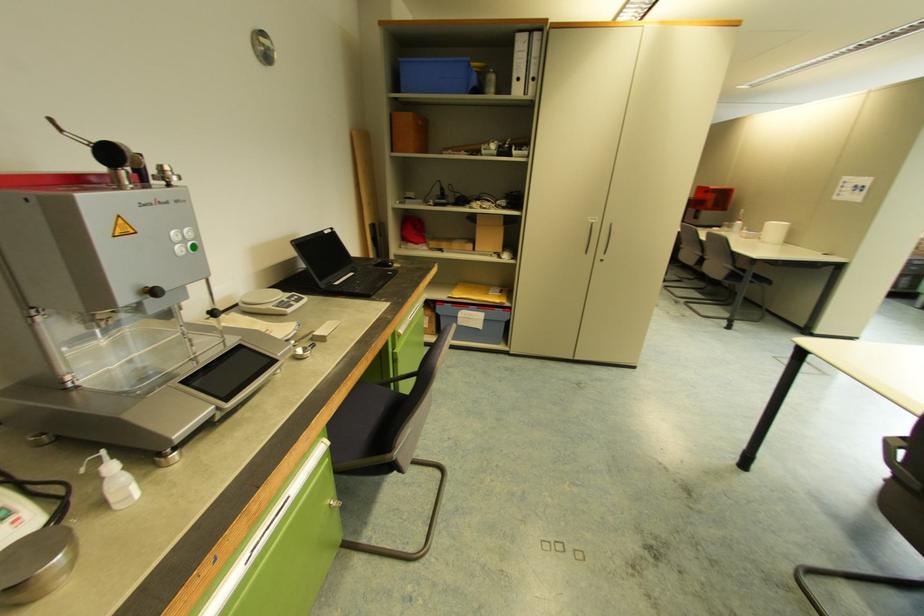
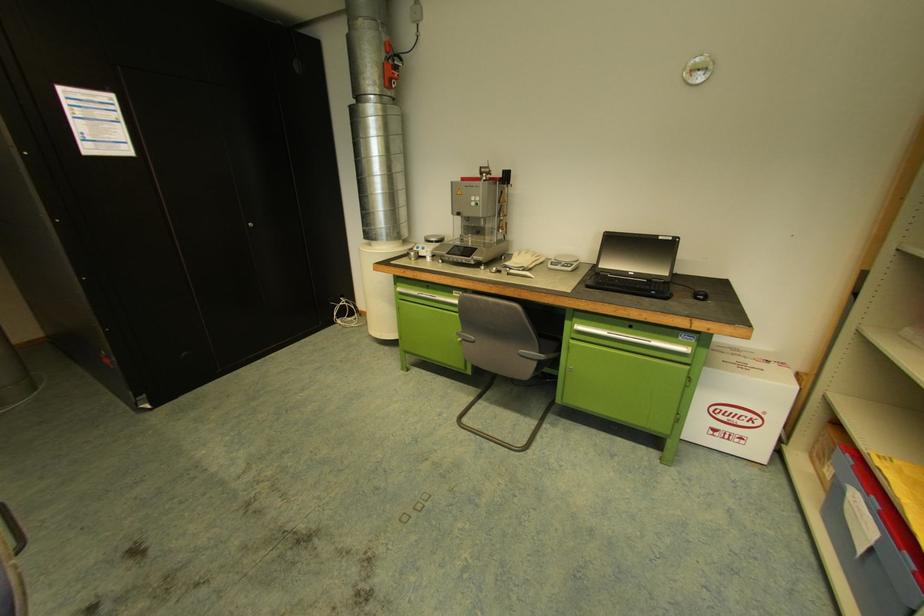
In the second image, find the point that corresponds to (184,249) in the first image.

(477, 204)